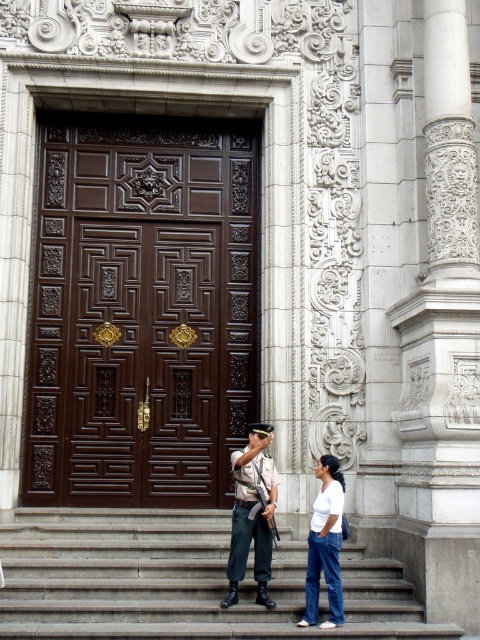
Question: Is dark wood door at center below white cotton shirt at center?

Choices:
 (A) no
 (B) yes

Answer: (A)

Question: Which of the following is the closest to the observer?

Choices:
 (A) (55, 362)
 (B) (170, 554)
 (C) (320, 509)
 (D) (264, 506)

Answer: (C)

Question: Which point is closer to the camera?

Choices:
 (A) dark wood door at center
 (B) gray concrete stairs at lower center
 (C) light brown uniform at center
 (D) white stone column at right

Answer: (B)

Question: Does white cotton shirt at center lie behind light brown uniform at center?

Choices:
 (A) no
 (B) yes

Answer: (A)

Question: Which point appears farthest from the camera in this image?

Choices:
 (A) (187, 250)
 (B) (454, 285)
 (C) (275, 563)

Answer: (A)

Question: From the image, what is the correct spatial relationship of gray concrete stairs at lower center in relation to white cotton shirt at lower center?

Choices:
 (A) below
 (B) above

Answer: (A)